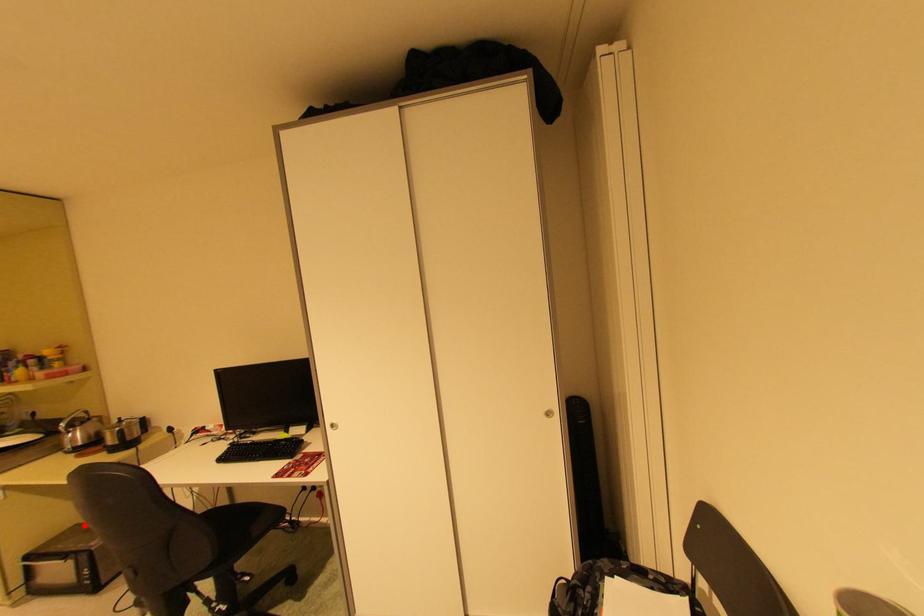
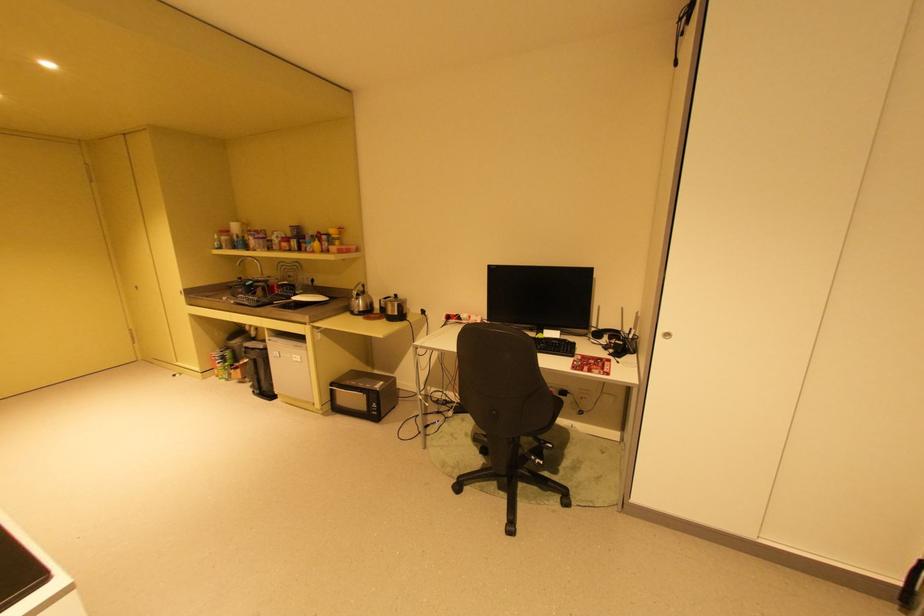
Locate, in the second image, the point that corresponds to the highlighted location in the first image.

(359, 371)